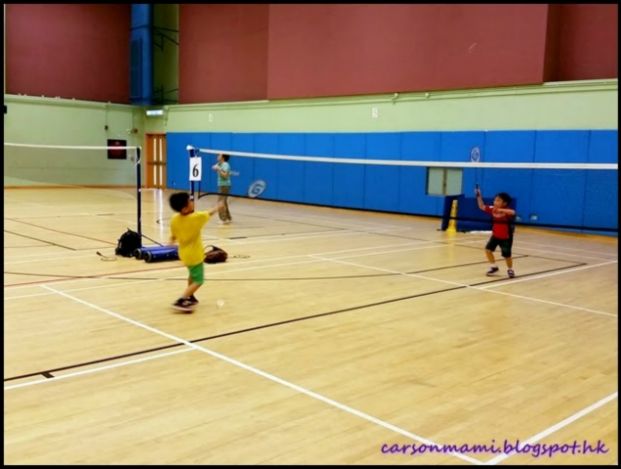
This screenshot has width=621, height=469. In order to click on red panels in this screenshot , I will do `click(377, 54)`, `click(592, 38)`, `click(218, 57)`, `click(73, 65)`.